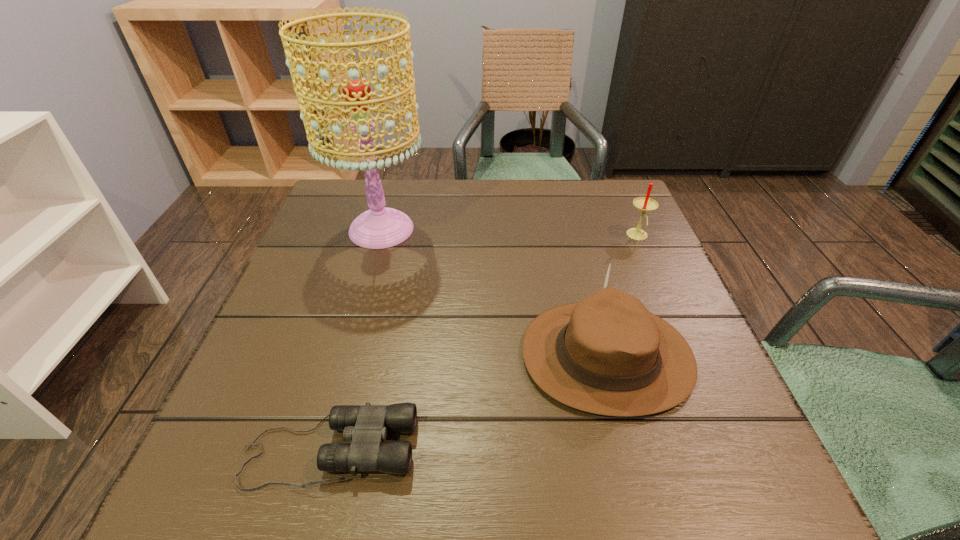
This screenshot has height=540, width=960. I want to click on blank space at the far edge of the desktop, so click(x=486, y=188).

The image size is (960, 540). What are the coordinates of `free space at the left edge of the desktop` in the screenshot? It's located at (252, 351).

Locate an element on the screen. vacant space at the right edge is located at coordinates (668, 421).

Identify the location of free location at the near left corner. (203, 475).

The width and height of the screenshot is (960, 540). In order to click on vacant region between the candle and the shortest object in this screenshot , I will do `click(484, 343)`.

Find the location of `vacant point located between the binoculars and the tallest object`. vacant point located between the binoculars and the tallest object is located at coordinates (355, 340).

This screenshot has height=540, width=960. I want to click on vacant point located between the shortest object and the fedora, so click(x=468, y=403).

You are a GUI agent. You are given a task and a screenshot of the screen. Output one action in this format:
    pyautogui.click(x=<x>, y=<y>)
    Task: Click on the free space that is in between the fedora and the shortest object
    
    Given the screenshot: What is the action you would take?
    pyautogui.click(x=468, y=403)

At what (x,y) coordinates should I click in order to perform the action: click on empty location between the fedora and the lampshade. Please return your answer as a coordinate pair (x, y). Looking at the image, I should click on (494, 293).

Locate an element on the screen. free spot between the candle and the tallest object is located at coordinates (510, 233).